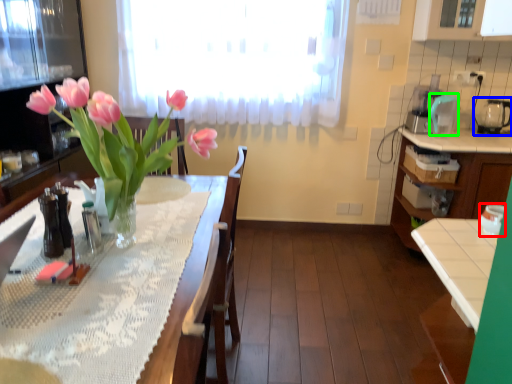
Question: Based on their relative distances, which object is nearer to appliance (highlighted by a red box)? Choose from appliance (highlighted by a blue box) and appliance (highlighted by a green box).

Choices:
 (A) appliance
 (B) appliance

Answer: (B)